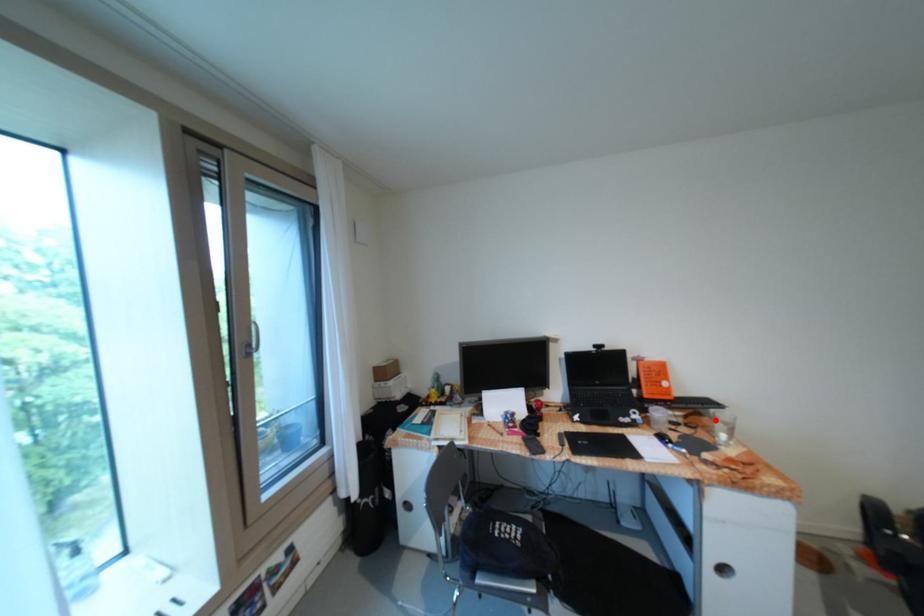
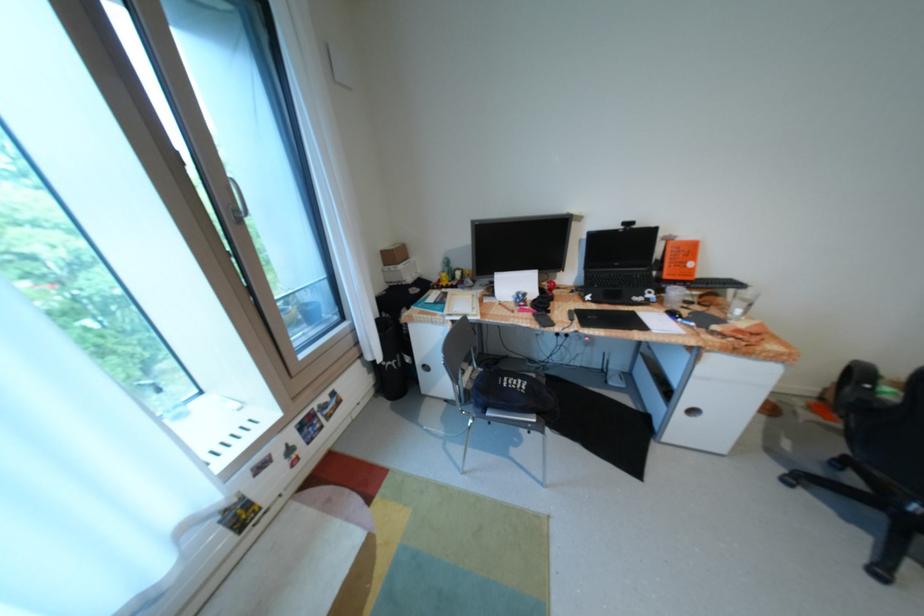
Where in the second image is the point corresponding to the highlighted location from the first image?

(731, 301)